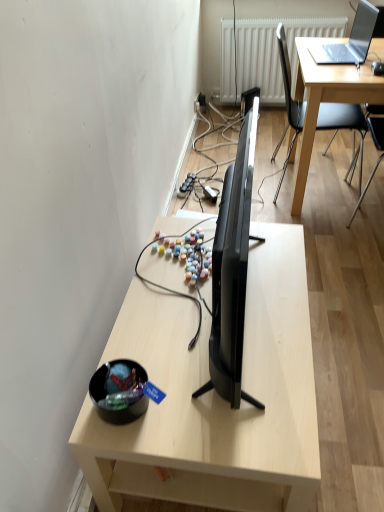
Question: From the image's perspective, would you say light wood desk at center is shown under black glossy tv at center?

Choices:
 (A) yes
 (B) no

Answer: (A)

Question: Does light wood desk at center lie in front of black glossy tv at center?

Choices:
 (A) no
 (B) yes

Answer: (A)

Question: Is light wood desk at center positioned behind black glossy tv at center?

Choices:
 (A) yes
 (B) no

Answer: (A)

Question: Is light wood desk at center wider than black glossy tv at center?

Choices:
 (A) yes
 (B) no

Answer: (A)

Question: Does light wood desk at center appear on the left side of black glossy tv at center?

Choices:
 (A) no
 (B) yes

Answer: (B)

Question: Considering the positions of point (344, 59) and point (145, 373), is point (344, 59) closer or farther from the camera than point (145, 373)?

Choices:
 (A) farther
 (B) closer

Answer: (A)

Question: Considering their positions, is sleek silver laptop at upper right located in front of or behind shiny black bowl at lower left?

Choices:
 (A) behind
 (B) front

Answer: (A)

Question: Looking at their shapes, would you say sleek silver laptop at upper right is wider or thinner than shiny black bowl at lower left?

Choices:
 (A) wide
 (B) thin

Answer: (A)

Question: From their relative heights in the image, would you say sleek silver laptop at upper right is taller or shorter than shiny black bowl at lower left?

Choices:
 (A) tall
 (B) short

Answer: (A)

Question: Based on their positions, is sleek silver laptop at upper right located to the left or right of black plastic chair at upper right?

Choices:
 (A) right
 (B) left

Answer: (A)

Question: Is point (367, 14) positioned closer to the camera than point (284, 69)?

Choices:
 (A) farther
 (B) closer

Answer: (B)

Question: Looking at their shapes, would you say sleek silver laptop at upper right is wider or thinner than black plastic chair at upper right?

Choices:
 (A) thin
 (B) wide

Answer: (A)

Question: Is sleek silver laptop at upper right inside or outside of black plastic chair at upper right?

Choices:
 (A) outside
 (B) inside

Answer: (B)

Question: Is white textured radiator at upper center bigger or smaller than black plastic chair at upper right?

Choices:
 (A) big
 (B) small

Answer: (B)

Question: Is white textured radiator at upper center situated inside black plastic chair at upper right or outside?

Choices:
 (A) inside
 (B) outside

Answer: (B)